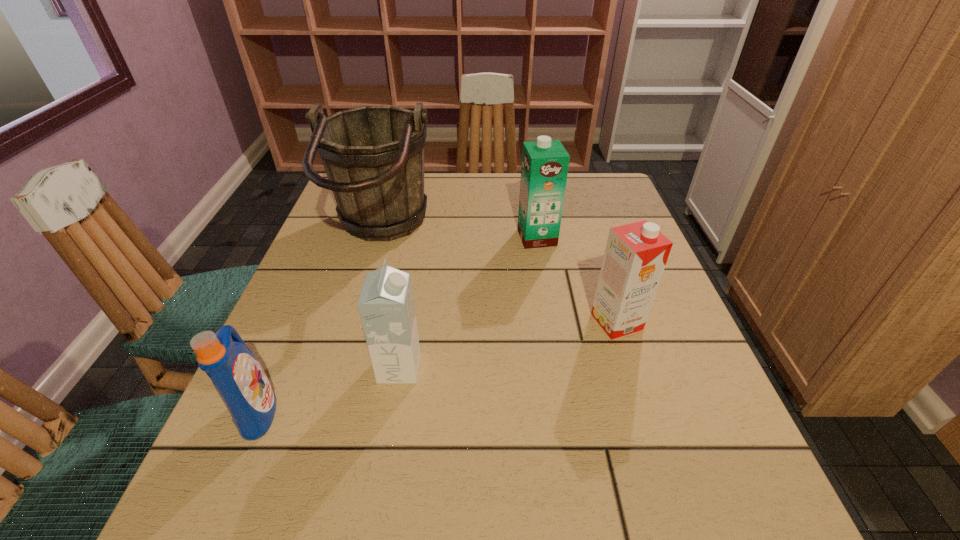
Identify the location of vacant space at the near right corner of the desktop. (762, 530).

Where is `vacant point located between the bucket and the rightmost object`? vacant point located between the bucket and the rightmost object is located at coordinates (498, 277).

At what (x,y) coordinates should I click in order to perform the action: click on free space between the third nearest object and the leftmost carton. Please return your answer as a coordinate pair (x, y). The image size is (960, 540). Looking at the image, I should click on (508, 345).

Locate an element on the screen. The height and width of the screenshot is (540, 960). free point between the second object from right to left and the leftmost carton is located at coordinates (468, 303).

Identify the location of vacant space that's between the bucket and the third farthest object. The image size is (960, 540). (498, 277).

Find the location of a particular element. unoccupied position between the nearest carton and the rightmost carton is located at coordinates (508, 345).

Locate an element on the screen. This screenshot has height=540, width=960. free spot between the nearest carton and the detergent is located at coordinates (329, 389).

I want to click on vacant area between the detergent and the bucket, so click(320, 322).

What are the coordinates of `vacant space that's between the nearest carton and the second carton from left to right` in the screenshot? It's located at (468, 303).

Point out which object is positioned as the fourth nearest to the second carton from right to left. Please provide its 2D coordinates. Your answer should be formatted as a tuple, i.e. [(x, y)], where the tuple contains the x and y coordinates of a point satisfying the conditions above.

[(238, 377)]